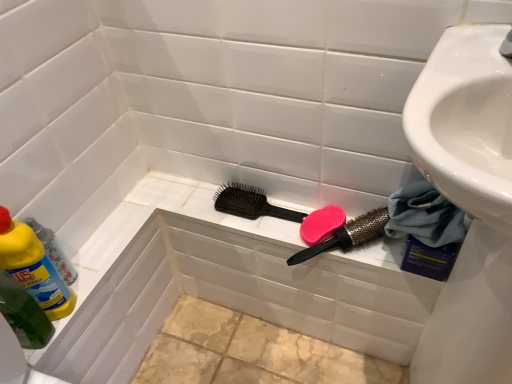
Question: From a real-world perspective, is pink rubber brush at center, the first brush in the right-to-left sequence, above or below blue fabric towel at lower right?

Choices:
 (A) above
 (B) below

Answer: (B)

Question: Is pink rubber brush at center, arranged as the 2th brush when viewed from the left, taller or shorter than blue fabric towel at lower right?

Choices:
 (A) short
 (B) tall

Answer: (A)

Question: Based on their relative distances, which object is farther from the green plastic bottle at left?

Choices:
 (A) pink rubber brush at center, the first brush in the right-to-left sequence
 (B) pink matte comb at center
 (C) black plastic hairbrush at center, which ranks as the second brush in right-to-left order
 (D) blue fabric towel at lower right

Answer: (D)

Question: Based on their relative distances, which object is nearer to the pink rubber brush at center, the first brush in the right-to-left sequence?

Choices:
 (A) blue fabric towel at lower right
 (B) black plastic hairbrush at center, the first brush when ordered from left to right
 (C) green plastic bottle at left
 (D) pink matte comb at center

Answer: (D)